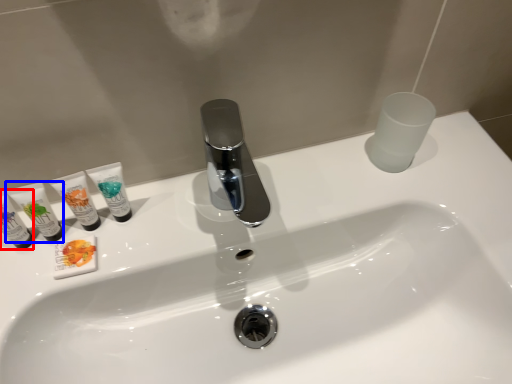
Question: Which of the following is the farthest to the observer, toiletry (highlighted by a red box) or toiletry (highlighted by a blue box)?

Choices:
 (A) toiletry
 (B) toiletry

Answer: (B)